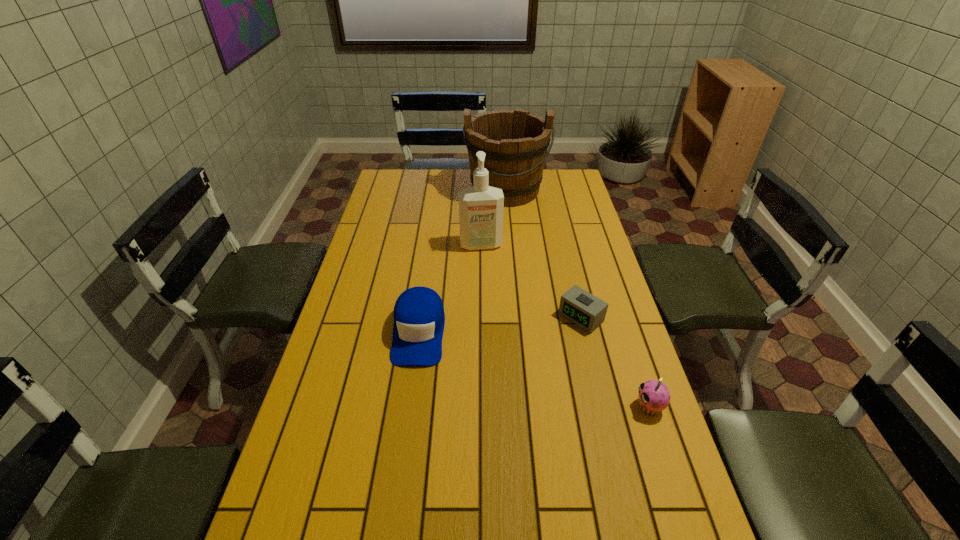
Find the location of a particular element. Image resolution: width=960 pixels, height=540 pixels. free space on the desktop that is between the baseball cap and the nearest object and is positioned on the front-facing side of the shortest object is located at coordinates (525, 366).

This screenshot has width=960, height=540. I want to click on vacant space on the desktop that is between the leftmost object and the cupcake and is positioned on the front label of the fourth nearest object, so click(500, 358).

The image size is (960, 540). What are the coordinates of `free space on the desktop that is between the leftmost object and the rightmost object and is positioned on the side of the farthest object with the handle for carrying` in the screenshot? It's located at (514, 362).